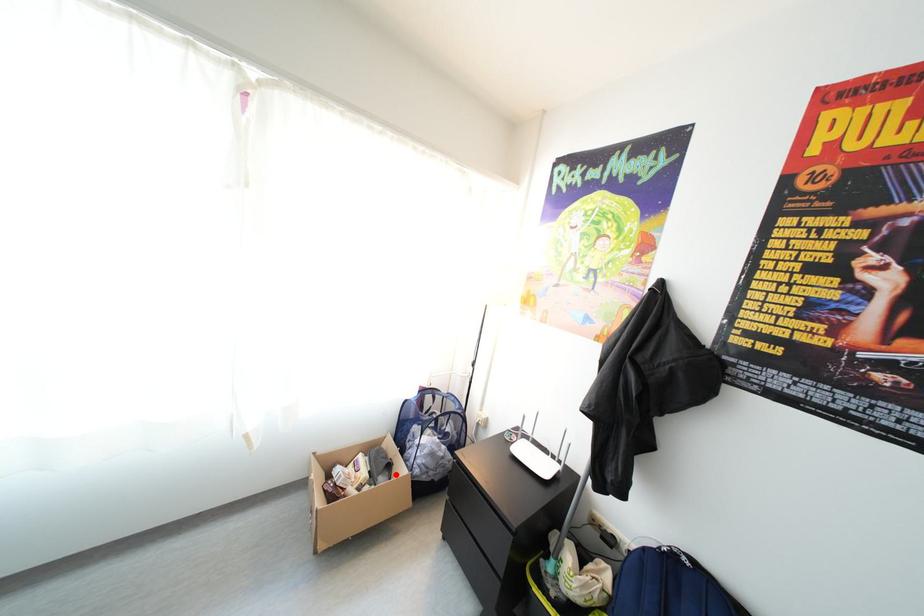
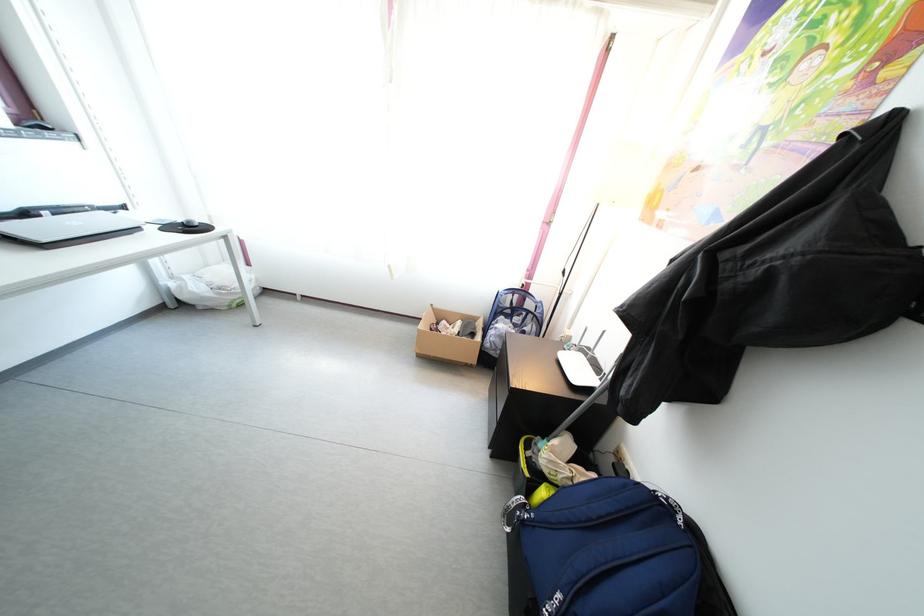
In the second image, find the point that corresponds to the highlighted location in the first image.

(480, 342)